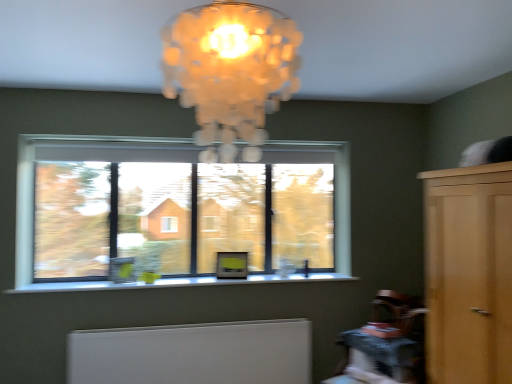
Question: From a real-world perspective, relative to clear glass window at center, is white matte radiator at lower center vertically above or below?

Choices:
 (A) below
 (B) above

Answer: (A)

Question: In the image, is white matte radiator at lower center positioned in front of or behind clear glass window at center?

Choices:
 (A) front
 (B) behind

Answer: (A)

Question: Based on their relative distances, which object is farther from the translucent glass chandelier at upper center?

Choices:
 (A) white smooth window sill at center
 (B) white matte radiator at lower center
 (C) light brown wood dresser at right
 (D) clear glass window at center
 (E) wooden textured table at lower right

Answer: (B)

Question: Which of these objects is positioned closest to the white matte radiator at lower center?

Choices:
 (A) white smooth window sill at center
 (B) translucent glass chandelier at upper center
 (C) clear glass window at center
 (D) wooden textured table at lower right
 (E) light brown wood dresser at right

Answer: (A)